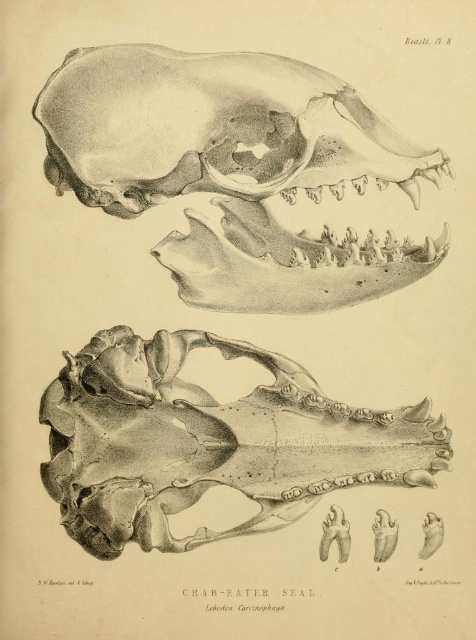
Between gray pencil sketch skull at upper center and gray bone skull at center, which one appears on the left side from the viewer's perspective?

gray pencil sketch skull at upper center is more to the left.

Is point (97, 150) farther from camera compared to point (277, 410)?

No, (97, 150) is in front of (277, 410).

The width and height of the screenshot is (476, 640). Describe the element at coordinates (235, 168) in the screenshot. I see `gray pencil sketch skull at upper center` at that location.

Where is `gray pencil sketch skull at upper center`? This screenshot has width=476, height=640. gray pencil sketch skull at upper center is located at coordinates (235, 168).